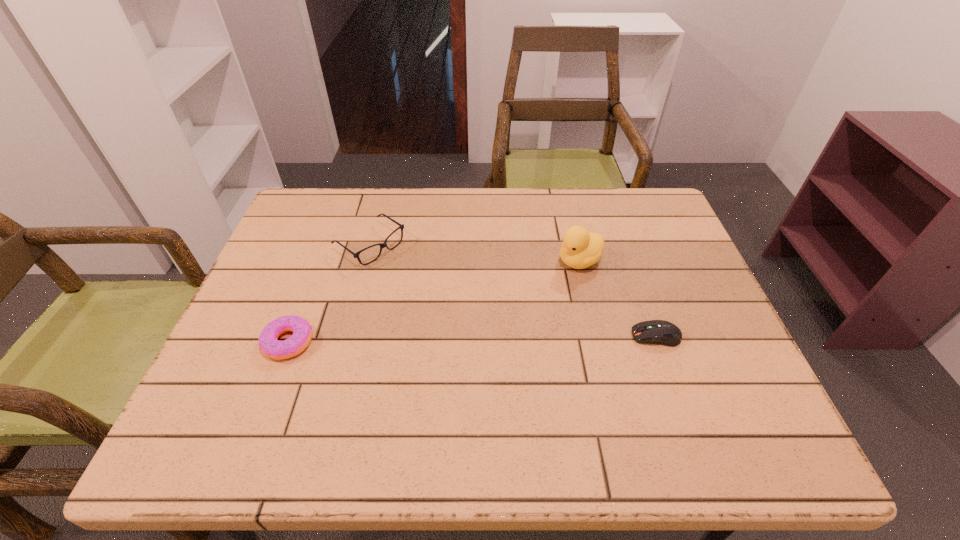
Where is `vacant space at the far edge of the desktop`? The height and width of the screenshot is (540, 960). vacant space at the far edge of the desktop is located at coordinates (421, 208).

Find the location of a particular element. The width and height of the screenshot is (960, 540). free location at the near edge is located at coordinates (574, 408).

The height and width of the screenshot is (540, 960). What are the coordinates of `free location at the left edge` in the screenshot? It's located at pyautogui.click(x=271, y=269).

I want to click on free space at the right edge of the desktop, so click(x=679, y=369).

Identify the location of vacant area at the near left corner of the desktop. (248, 405).

The width and height of the screenshot is (960, 540). What are the coordinates of `vacant region at the far right corner of the desktop` in the screenshot? It's located at (677, 230).

What are the coordinates of `vacant space at the near right corner of the desktop` in the screenshot? It's located at (765, 411).

Where is `vacant area that lies between the doughnut and the duck`? This screenshot has height=540, width=960. vacant area that lies between the doughnut and the duck is located at coordinates (434, 301).

This screenshot has width=960, height=540. I want to click on unoccupied area between the duck and the doughnut, so click(434, 301).

What are the coordinates of `vacant area that lies between the duck and the second tallest object` in the screenshot? It's located at (475, 253).